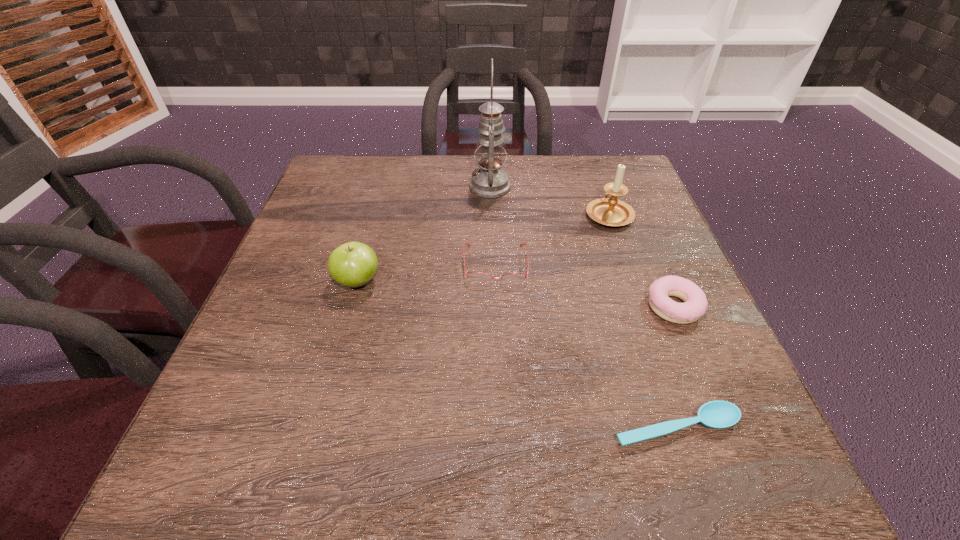
The height and width of the screenshot is (540, 960). What are the coordinates of `vacant space located with a handle on the side of the fifth shortest object` in the screenshot? It's located at (596, 179).

The height and width of the screenshot is (540, 960). Find the location of `vacant space located 0.110m with a handle on the side of the fifth shortest object`. vacant space located 0.110m with a handle on the side of the fifth shortest object is located at coordinates (595, 176).

The image size is (960, 540). I want to click on vacant space located on the right of the third tallest object, so click(x=488, y=282).

In order to click on free spot located 0.120m on the left of the doughnut in this screenshot , I will do `click(586, 307)`.

Identify the location of free spot located 0.110m on the lenses of the second shortest object. (498, 327).

The image size is (960, 540). What are the coordinates of `vacant space located 0.400m on the left of the nearest object` in the screenshot? It's located at (353, 428).

Find the location of a particular element. This screenshot has height=540, width=960. oil lamp that is at the far edge is located at coordinates (490, 181).

What are the coordinates of `candle holder that is at the far edge` in the screenshot? It's located at tap(608, 211).

Identify the location of object that is at the near edge. This screenshot has width=960, height=540. (718, 414).

The height and width of the screenshot is (540, 960). I want to click on object present at the left edge, so click(x=353, y=264).